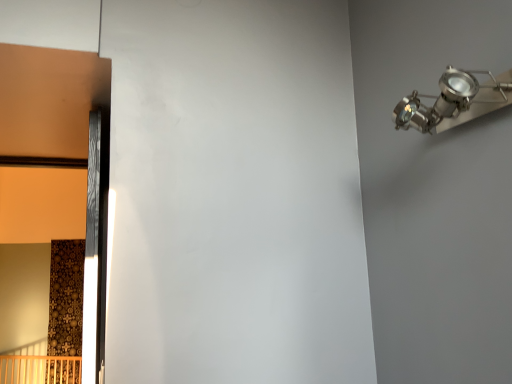
The image size is (512, 384). Describe the element at coordinates (454, 101) in the screenshot. I see `metallic silver spotlight at upper right` at that location.

Identify the location of metallic silver spotlight at upper right. The height and width of the screenshot is (384, 512). (454, 101).

Where is `wooden door at left`? wooden door at left is located at coordinates (94, 259).

Image resolution: width=512 pixels, height=384 pixels. What do you see at coordinates (94, 259) in the screenshot?
I see `wooden door at left` at bounding box center [94, 259].

Locate an element on the screen. The height and width of the screenshot is (384, 512). metallic silver spotlight at upper right is located at coordinates (454, 101).

In the image, is metallic silver spotlight at upper right on the left side or the right side of wooden door at left?

From the image, it's evident that metallic silver spotlight at upper right is to the right of wooden door at left.

Considering the positions of objects metallic silver spotlight at upper right and wooden door at left in the image provided, who is in front, metallic silver spotlight at upper right or wooden door at left?

metallic silver spotlight at upper right is closer to the camera.

Is point (412, 93) positioned behind point (92, 162)?

No, it is not.

From the image's perspective, is metallic silver spotlight at upper right below wooden door at left?

No, from the image's perspective, metallic silver spotlight at upper right is not below wooden door at left.

From a real-world perspective, which is physically below, metallic silver spotlight at upper right or wooden door at left?

wooden door at left.

Which object is thinner, metallic silver spotlight at upper right or wooden door at left?

wooden door at left is thinner.

Which of these two, metallic silver spotlight at upper right or wooden door at left, stands shorter?

metallic silver spotlight at upper right is shorter.

Considering the sizes of objects metallic silver spotlight at upper right and wooden door at left in the image provided, who is smaller, metallic silver spotlight at upper right or wooden door at left?

Smaller between the two is metallic silver spotlight at upper right.

Can we say metallic silver spotlight at upper right lies outside wooden door at left?

Indeed, metallic silver spotlight at upper right is completely outside wooden door at left.

Are metallic silver spotlight at upper right and wooden door at left far apart?

No, metallic silver spotlight at upper right is in close proximity to wooden door at left.

Does metallic silver spotlight at upper right turn towards wooden door at left?

No, metallic silver spotlight at upper right is not aimed at wooden door at left.

Measure the distance between metallic silver spotlight at upper right and wooden door at left.

A distance of 37.77 inches exists between metallic silver spotlight at upper right and wooden door at left.

Locate an element on the screen. This screenshot has height=384, width=512. light fixture on the right of wooden door at left is located at coordinates (454, 101).

Considering the relative positions of wooden door at left and metallic silver spotlight at upper right in the image provided, is wooden door at left to the left of metallic silver spotlight at upper right from the viewer's perspective?

Yes, wooden door at left is to the left of metallic silver spotlight at upper right.

Is the position of wooden door at left more distant than that of metallic silver spotlight at upper right?

Yes, it is.

Considering the positions of points (94, 215) and (453, 99), is point (94, 215) closer to camera compared to point (453, 99)?

That is False.

From the image's perspective, which is below, wooden door at left or metallic silver spotlight at upper right?

wooden door at left, from the image's perspective.

From a real-world perspective, which is physically above, wooden door at left or metallic silver spotlight at upper right?

metallic silver spotlight at upper right, from a real-world perspective.

Between wooden door at left and metallic silver spotlight at upper right, which one has smaller width?

With smaller width is wooden door at left.

Who is shorter, wooden door at left or metallic silver spotlight at upper right?

metallic silver spotlight at upper right.

Can you confirm if wooden door at left is bigger than metallic silver spotlight at upper right?

Correct, wooden door at left is larger in size than metallic silver spotlight at upper right.

Is wooden door at left completely or partially outside of metallic silver spotlight at upper right?

Indeed, wooden door at left is completely outside metallic silver spotlight at upper right.

Is wooden door at left beside metallic silver spotlight at upper right?

No, wooden door at left is not beside metallic silver spotlight at upper right.

Is wooden door at left positioned with its back to metallic silver spotlight at upper right?

wooden door at left is not turned away from metallic silver spotlight at upper right.

Find the location of a particular element. light fixture on the right of wooden door at left is located at coordinates tap(454, 101).

The width and height of the screenshot is (512, 384). Find the location of `door below the metallic silver spotlight at upper right (from the image's perspective)`. door below the metallic silver spotlight at upper right (from the image's perspective) is located at coordinates (94, 259).

Identify the location of light fixture above the wooden door at left (from the image's perspective). (454, 101).